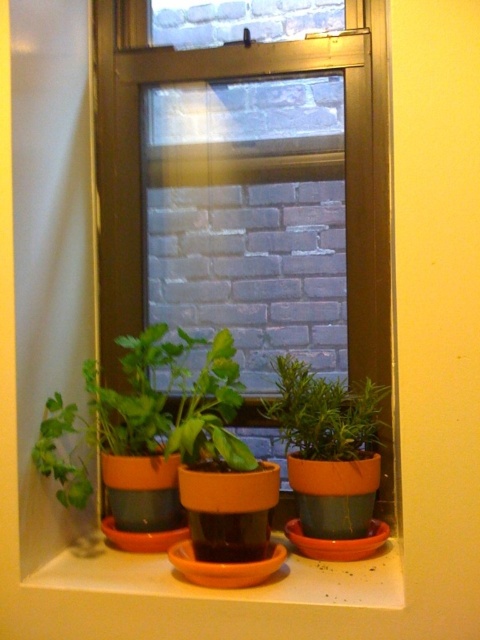
Does metallic brown window frame at center appear on the left side of matte orange pot at left?

No, metallic brown window frame at center is not to the left of matte orange pot at left.

Does point (346, 88) come in front of point (82, 432)?

No, it is not.

Find the location of a particular element. The width and height of the screenshot is (480, 640). metallic brown window frame at center is located at coordinates (123, 164).

Between orange clay pot at lower center and green matte plant at center, which one has more height?

Standing taller between the two is green matte plant at center.

Is orange clay pot at lower center to the left of green matte plant at center from the viewer's perspective?

Correct, you'll find orange clay pot at lower center to the left of green matte plant at center.

Identify the location of orange clay pot at lower center. The image size is (480, 640). (233, 589).

I want to click on orange clay pot at lower center, so click(x=233, y=589).

Between matte orange pot at left and orange clay pot at lower center, which one appears on the left side from the viewer's perspective?

From the viewer's perspective, matte orange pot at left appears more on the left side.

Is matte orange pot at left bigger than orange clay pot at lower center?

Yes.

At what (x,y) coordinates should I click in order to perform the action: click on matte orange pot at left. Please return your answer as a coordinate pair (x, y). Looking at the image, I should click on (151, 410).